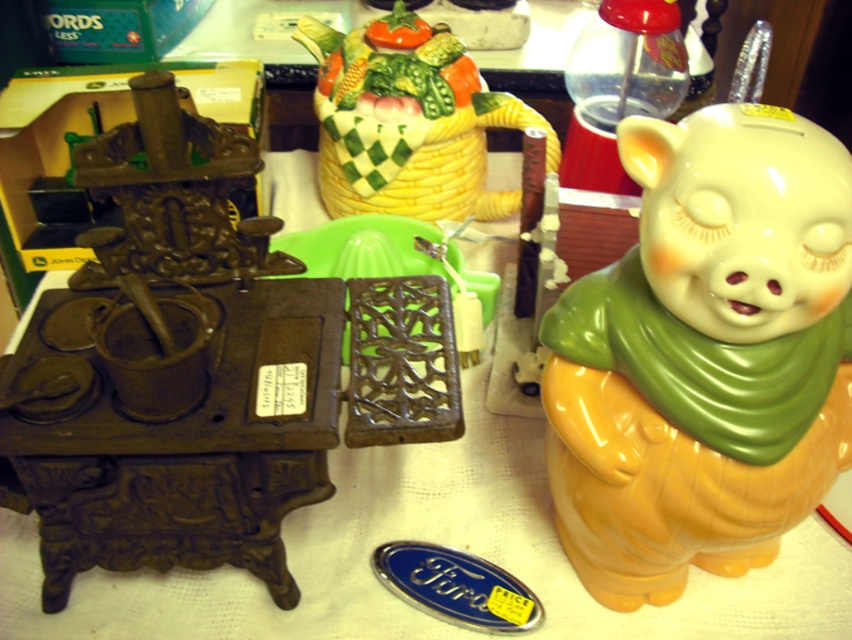
Is matte yellow piggy bank at right below porcelain basket at upper center?

Indeed, matte yellow piggy bank at right is positioned under porcelain basket at upper center.

Is point (756, 433) behind point (452, 164)?

No, (756, 433) is in front of (452, 164).

You are a GUI agent. You are given a task and a screenshot of the screen. Output one action in this format:
    pyautogui.click(x=<x>, y=<y>)
    Task: Click on the matte yellow piggy bank at right
    The height and width of the screenshot is (640, 852).
    Given the screenshot: What is the action you would take?
    pyautogui.click(x=704, y=355)

Locate an element on the screen. matte yellow piggy bank at right is located at coordinates (704, 355).